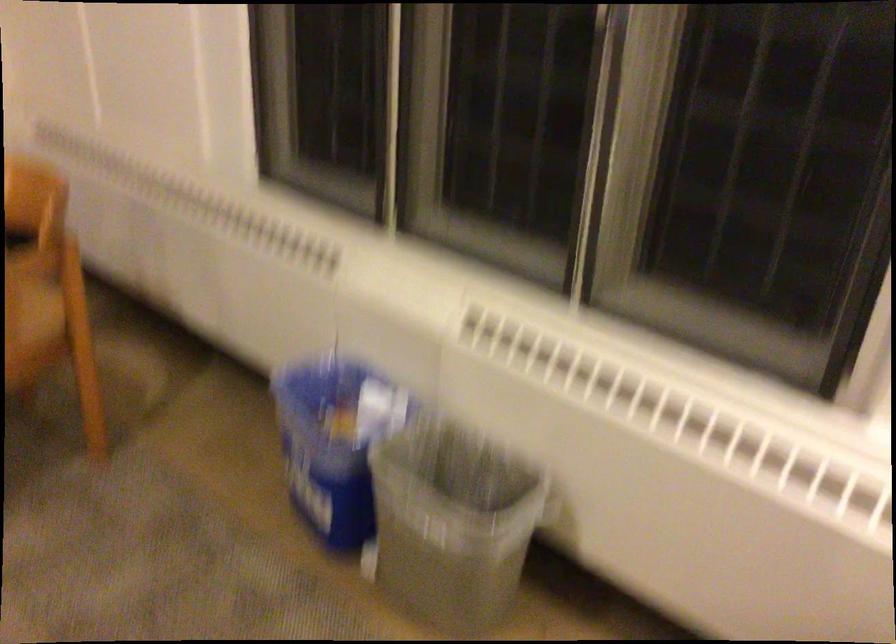
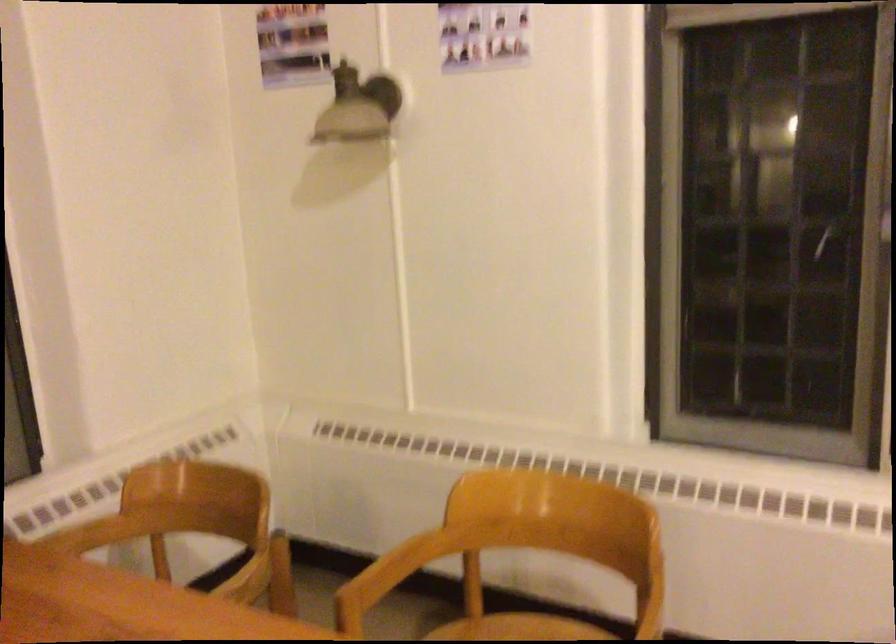
Question: Which direction would the cameraman need to move to produce the second image? Reply with the corresponding letter.

Choices:
 (A) Left
 (B) Right
 (C) Forward
 (D) Backward

Answer: (A)